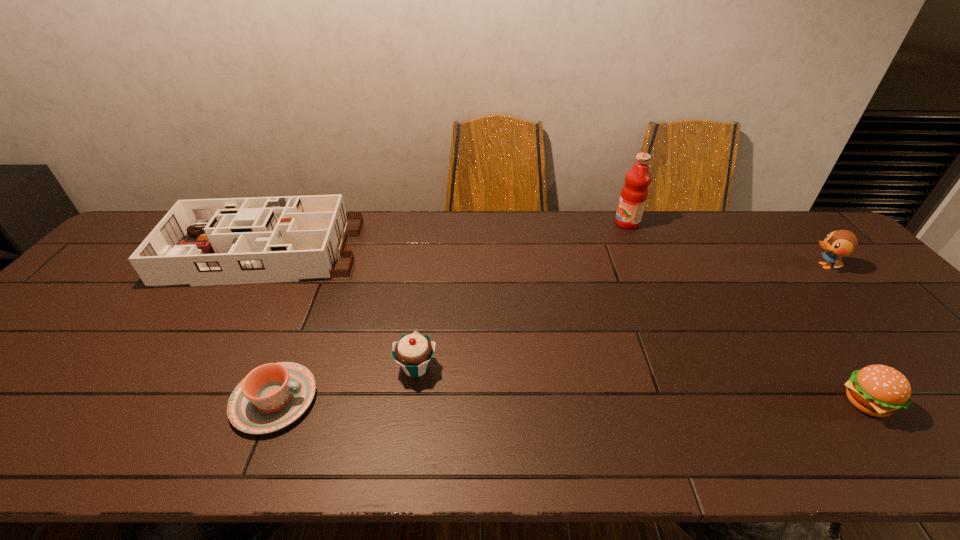
I want to click on chinaware located in the near edge section of the desktop, so click(272, 396).

This screenshot has width=960, height=540. What are the coordinates of `object that is at the left edge` in the screenshot? It's located at (256, 240).

You are a GUI agent. You are given a task and a screenshot of the screen. Output one action in this format:
    pyautogui.click(x=<x>, y=<y>)
    Task: Click on the object positioned at the right edge
    Image resolution: width=960 pixels, height=540 pixels.
    Given the screenshot: What is the action you would take?
    pyautogui.click(x=839, y=243)

Identify the location of object that is positioned at the far left corner. (256, 240).

Find the location of a particular element. This screenshot has width=960, height=540. free space at the far edge of the desktop is located at coordinates (707, 234).

Locate an element on the screen. vacant space at the near edge of the desktop is located at coordinates (213, 424).

Find the location of `vacant area at the left edge of the desktop`. vacant area at the left edge of the desktop is located at coordinates (54, 363).

This screenshot has width=960, height=540. In the image, there is a desktop. In order to click on vacant space at the right edge in this screenshot , I will do `click(938, 379)`.

The width and height of the screenshot is (960, 540). In order to click on unoccupied area between the shortest object and the hamburger in this screenshot , I will do `click(570, 401)`.

You are a GUI agent. You are given a task and a screenshot of the screen. Output one action in this format:
    pyautogui.click(x=<x>, y=<y>)
    Task: Click on the empty space between the fourth object from left to right and the dollhouse
    
    Given the screenshot: What is the action you would take?
    444,238